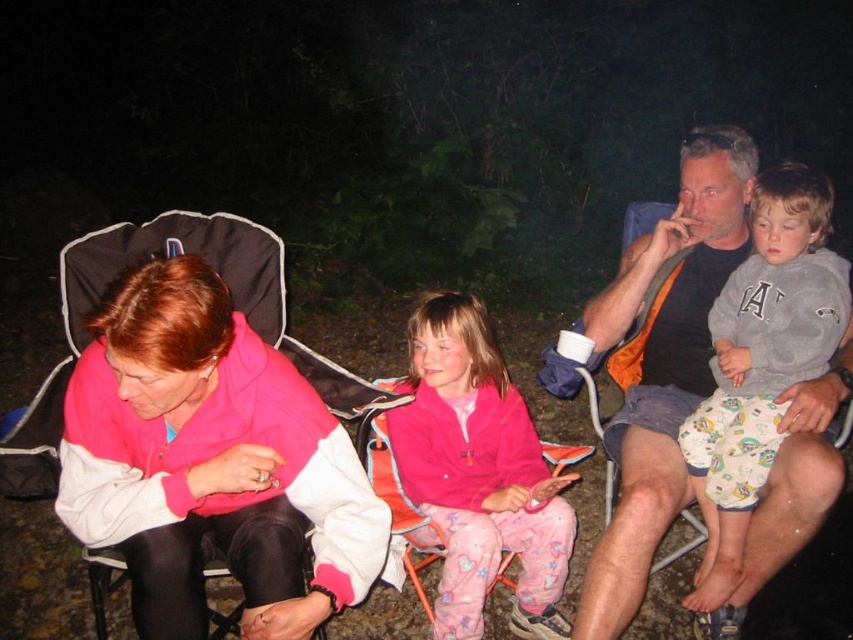
Is pink fleece jacket at center wider than gray cotton sweatshirt at upper right?

Indeed, pink fleece jacket at center has a greater width compared to gray cotton sweatshirt at upper right.

Does pink fleece jacket at center appear under gray cotton sweatshirt at upper right?

Correct, pink fleece jacket at center is located below gray cotton sweatshirt at upper right.

Find the location of a particular element. pink fleece jacket at center is located at coordinates (479, 472).

The height and width of the screenshot is (640, 853). In order to click on pink fleece jacket at center in this screenshot , I will do `click(479, 472)`.

Is point (91, 497) in front of point (447, 413)?

Yes, point (91, 497) is in front of point (447, 413).

Where is `pink fleece jacket at left`? pink fleece jacket at left is located at coordinates (212, 461).

At what (x,y) coordinates should I click in order to perform the action: click on pink fleece jacket at left. Please return your answer as a coordinate pair (x, y). The image size is (853, 640). Looking at the image, I should click on (212, 461).

Which is more to the right, pink fleece jacket at left or gray cotton sweatshirt at upper right?

Positioned to the right is gray cotton sweatshirt at upper right.

At what (x,y) coordinates should I click in order to perform the action: click on pink fleece jacket at left. Please return your answer as a coordinate pair (x, y). Looking at the image, I should click on (212, 461).